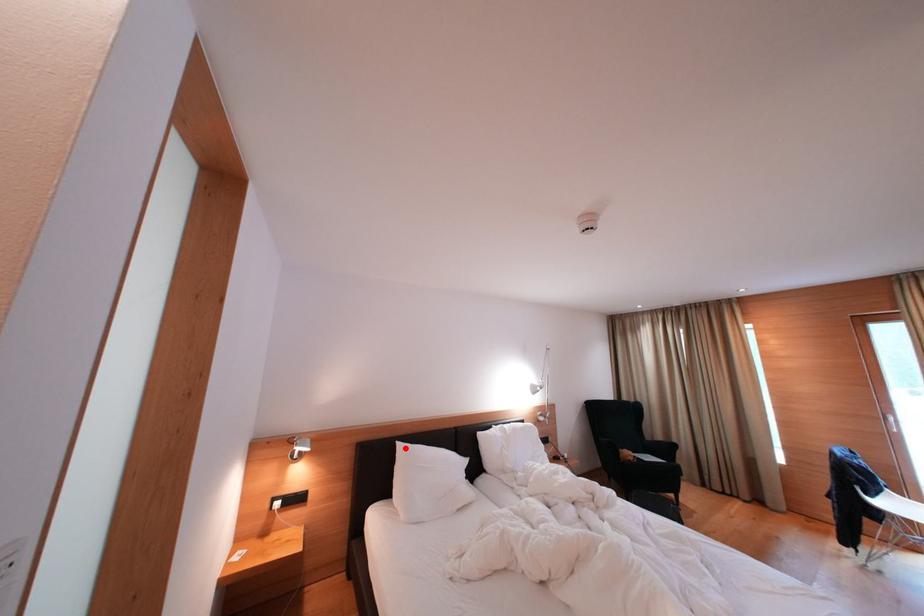
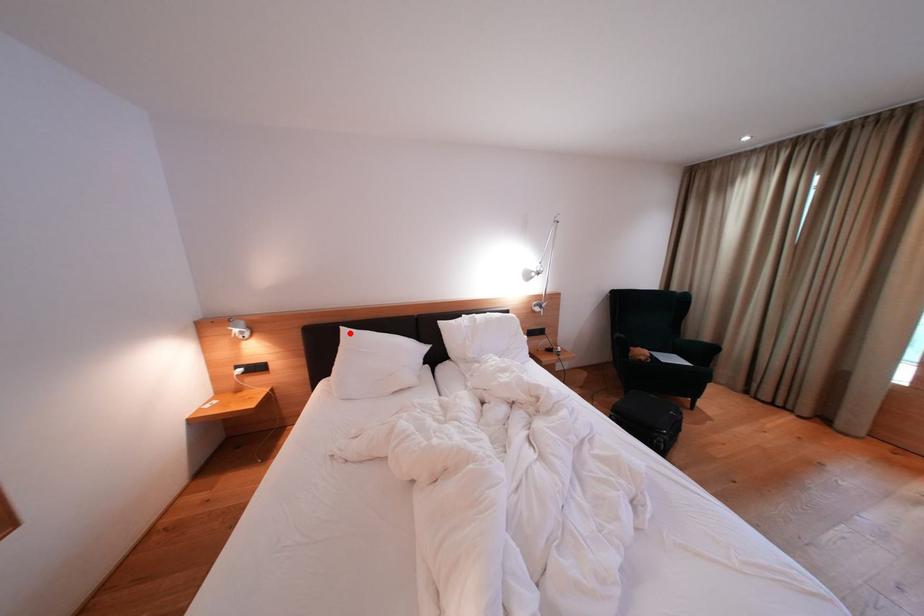
I am providing you with two images of the same scene from different viewpoints. A red point is marked on the first image and another point is marked on the second image. Is the marked point in image1 the same physical position as the marked point in image2?

Yes